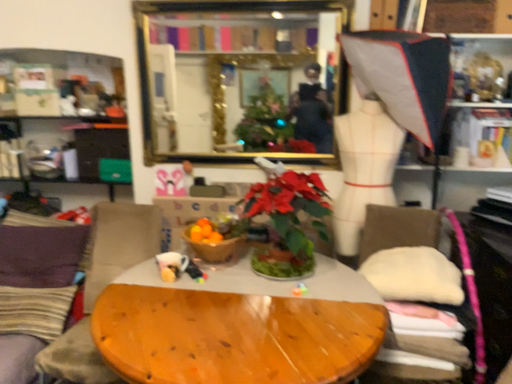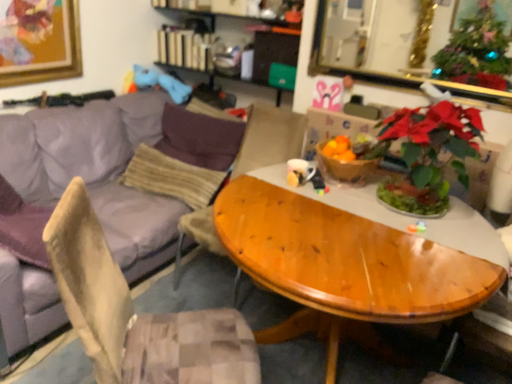
Question: Which way did the camera rotate in the video?

Choices:
 (A) rotated right
 (B) rotated left

Answer: (B)